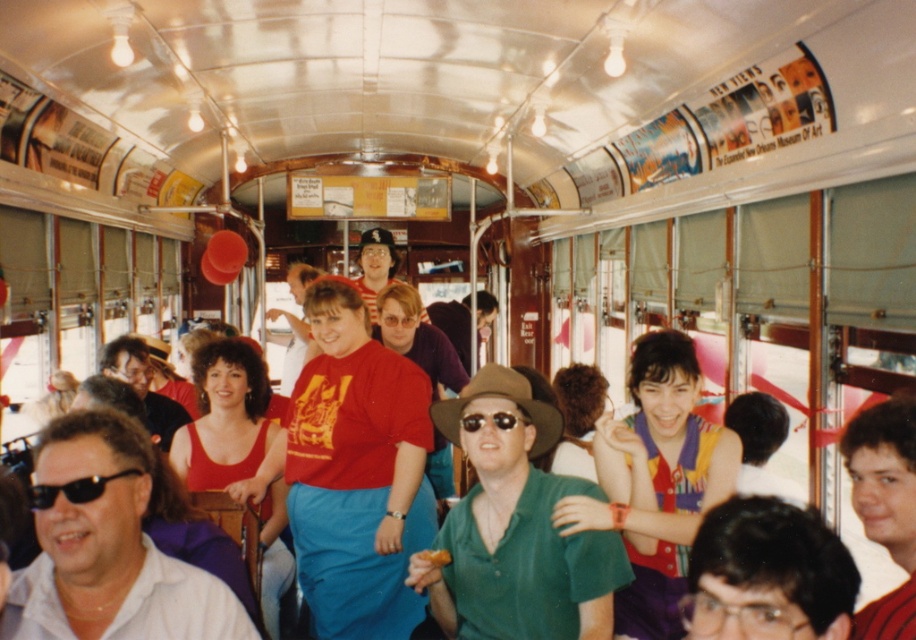
You are a tailor standing in the vintage trolley and need to measure the distance between the green cotton shirt at center and the black plastic sunglasses at lower left. Can you fit a 4.5 feet long measuring tape between them?

The distance between the green cotton shirt at center and the black plastic sunglasses at lower left is 5.01 feet. Since the measuring tape is 4.5 feet long, it cannot fully span the distance between them.

You are a fashion designer observing the vintage trolley scene. You notice two shirts in the crowd. The first is a white matte shirt at lower left, and the second is a green cotton shirt at center. Which shirt has a greater width when laid flat?

The white matte shirt at lower left has a greater width than the green cotton shirt at center, as its width surpasses the latter according to the description.

You are a tour guide standing in the vintage trolley and need to hand out maps to two tourists wearing the white matte shirt at lower left and the green cotton shirt at center. The map dispenser is located 1.5 meters away from you. Can you reach both tourists without moving from your current position?

The white matte shirt at lower left and green cotton shirt at center are 1.36 meters apart from each other. Since the dispenser is 1.5 meters away from you, you can reach both tourists as the distance between them is within the dispenser range.